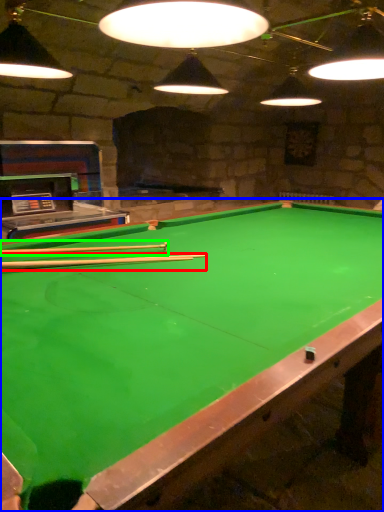
Question: Which object is the farthest from cue (highlighted by a red box)? Choose among these: billiard table (highlighted by a blue box) or cue (highlighted by a green box).

Choices:
 (A) billiard table
 (B) cue

Answer: (A)